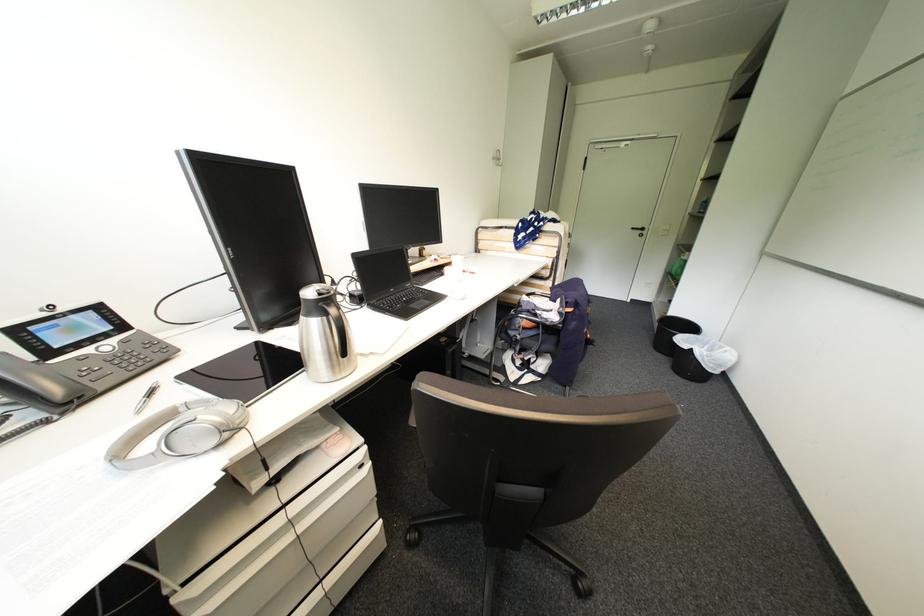
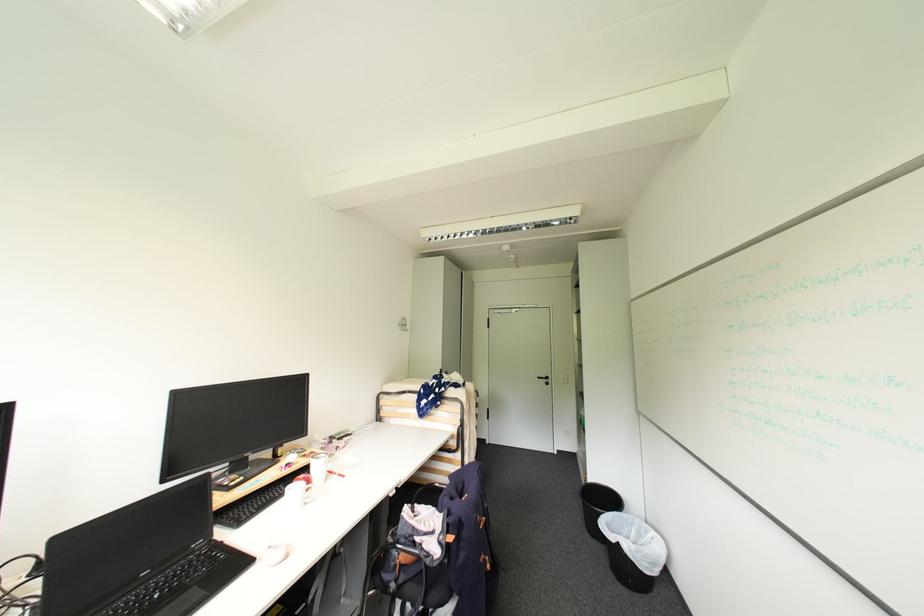
In the second image, find the point that corresponds to (699,336) in the first image.

(624, 514)